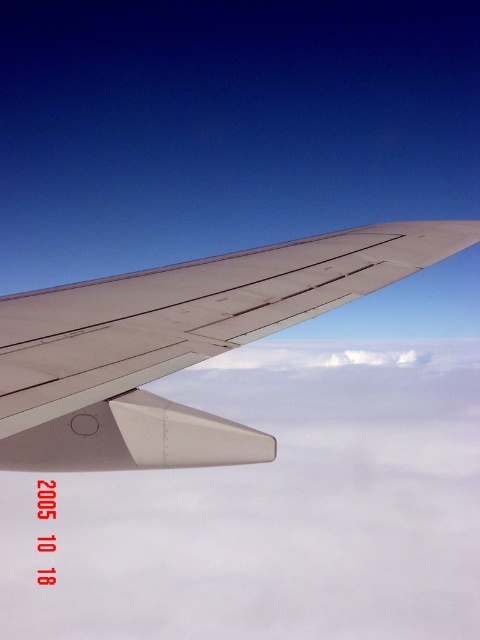
Does point (57, 536) come behind point (106, 284)?

Yes, it is.

Does white fluffy cloud at center have a greater height compared to metallic gray wing at upper center?

Indeed, white fluffy cloud at center has a greater height compared to metallic gray wing at upper center.

This screenshot has height=640, width=480. Describe the element at coordinates (273, 508) in the screenshot. I see `white fluffy cloud at center` at that location.

This screenshot has height=640, width=480. I want to click on white fluffy cloud at center, so click(273, 508).